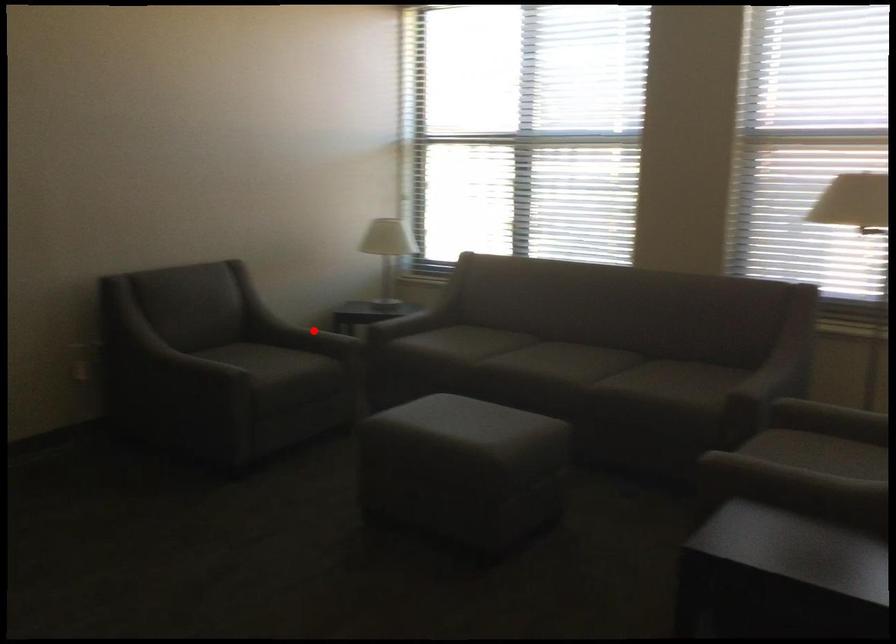
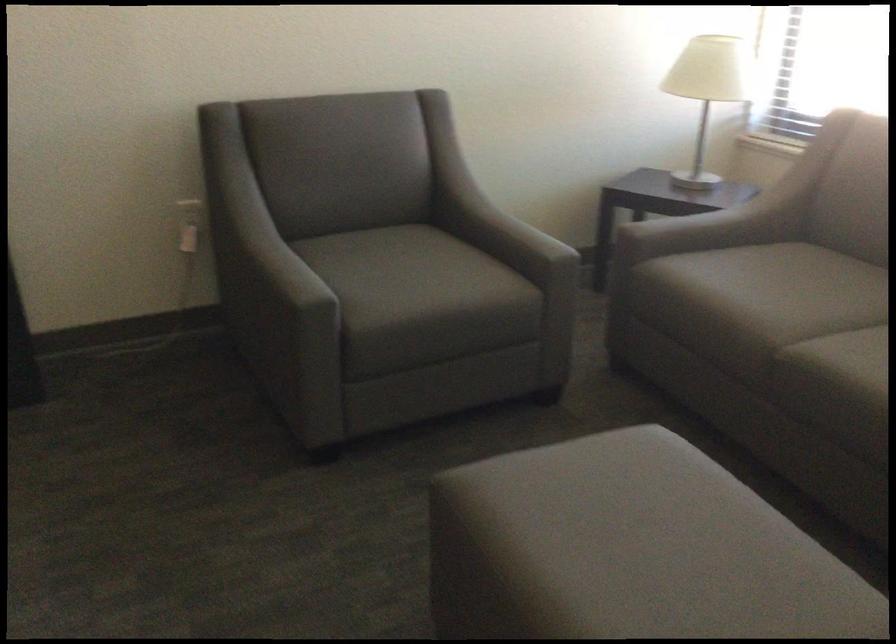
Question: I am providing you with two images of the same scene from different viewpoints. In image1, a red point is highlighted. Considering the same 3D point in image2, which of the following is correct?

Choices:
 (A) It is closer
 (B) It is farther

Answer: (A)